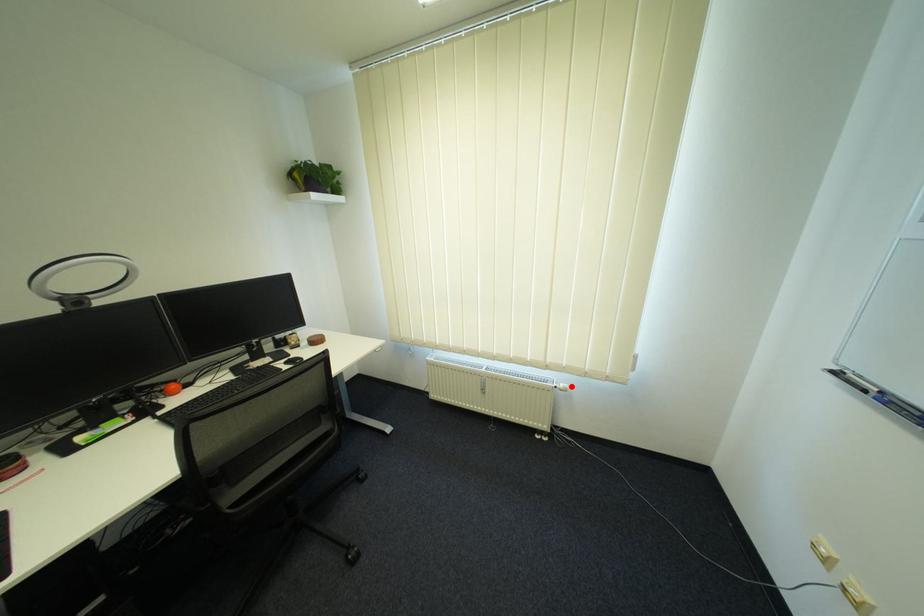
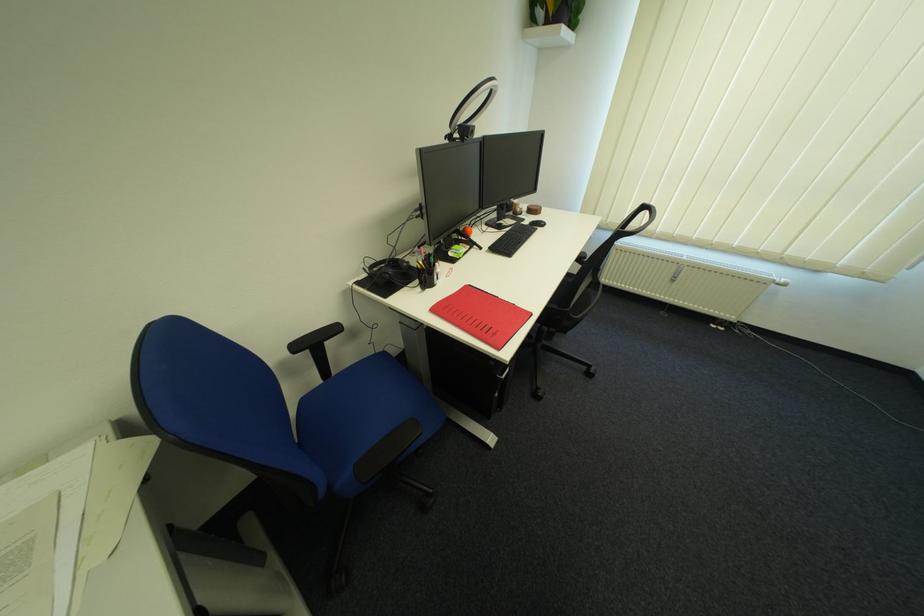
Where in the second image is the point corresponding to the highlighted location from the first image?

(793, 281)